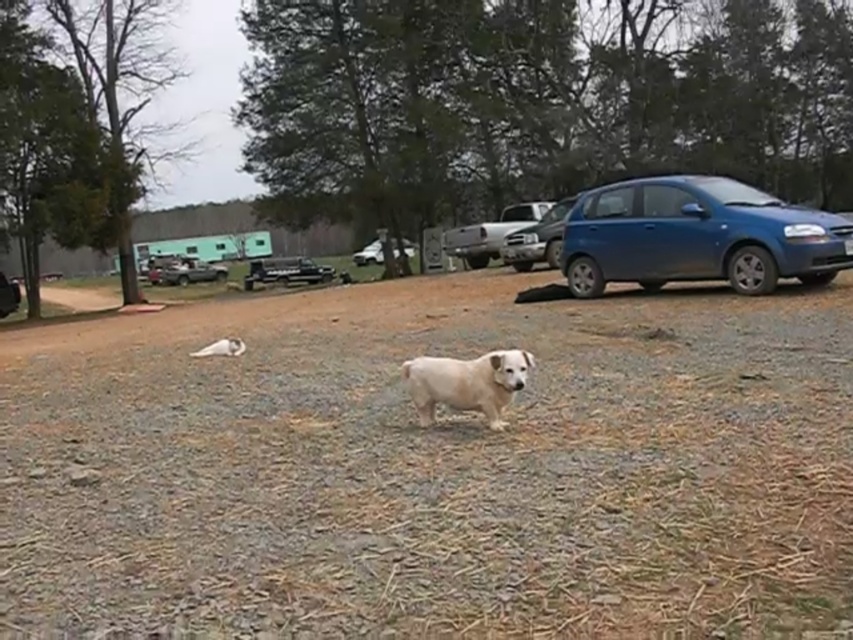
Question: Is blue metallic car at right to the right of metallic silver truck at center from the viewer's perspective?

Choices:
 (A) yes
 (B) no

Answer: (A)

Question: Which object is the closest to the silver metallic truck at center?

Choices:
 (A) metallic blue sedan at center right
 (B) black matte truck at center

Answer: (A)

Question: Does black matte truck at center have a greater width compared to white matte car at center?

Choices:
 (A) yes
 (B) no

Answer: (A)

Question: Which point is farther from the camera taking this photo?

Choices:
 (A) (7, 301)
 (B) (421, 355)
 (C) (548, 220)

Answer: (A)

Question: Which point appears closest to the camera in this image?

Choices:
 (A) (0, 288)
 (B) (218, 264)
 (C) (496, 356)

Answer: (C)

Question: From the image, what is the correct spatial relationship of blue metallic car at right in relation to metallic silver car at center?

Choices:
 (A) above
 (B) below

Answer: (A)